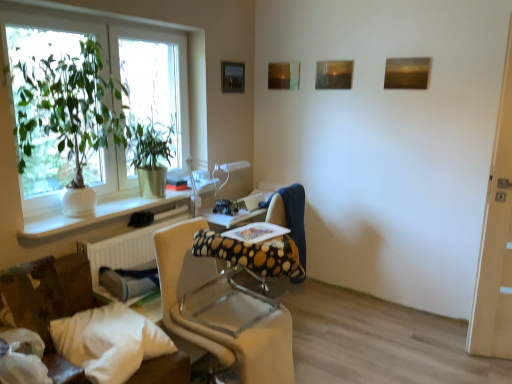
This screenshot has width=512, height=384. Identify the location of vacant space situated on the left part of transparent glass door at right. (455, 357).